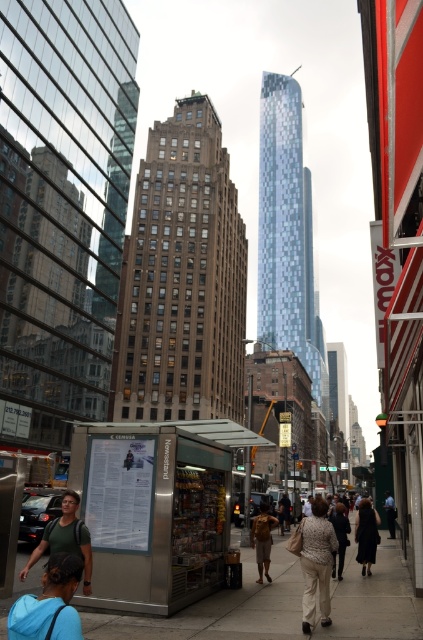
Who is lower down, gray concrete sidewalk at center or dark fabric coat at lower right?

dark fabric coat at lower right is lower down.

Is gray concrete sidewalk at center behind dark fabric coat at lower right?

No, gray concrete sidewalk at center is in front of dark fabric coat at lower right.

Locate an element on the screen. gray concrete sidewalk at center is located at coordinates (220, 609).

Is the position of dark fabric coat at lower right less distant than that of dark gray pants at center?

Yes, dark fabric coat at lower right is closer to the viewer.

Does point (370, 515) lie in front of point (389, 515)?

Yes, it is in front of point (389, 515).

What do you see at coordinates (365, 534) in the screenshot? This screenshot has width=423, height=640. I see `dark fabric coat at lower right` at bounding box center [365, 534].

You are a GUI agent. You are given a task and a screenshot of the screen. Output one action in this format:
    pyautogui.click(x=<x>, y=<y>)
    Task: Click on the dark fabric coat at lower right
    Image resolution: width=423 pixels, height=640 pixels.
    Given the screenshot: What is the action you would take?
    pyautogui.click(x=365, y=534)

Does dark brown leather jacket at center have a smaller size compared to light beige fabric coat at center?

A: Yes.

Can you confirm if dark brown leather jacket at center is taller than light beige fabric coat at center?

No, dark brown leather jacket at center is not taller than light beige fabric coat at center.

Is point (346, 522) positioned before point (310, 500)?

That is True.

Identify the location of dark brown leather jacket at center. (340, 538).